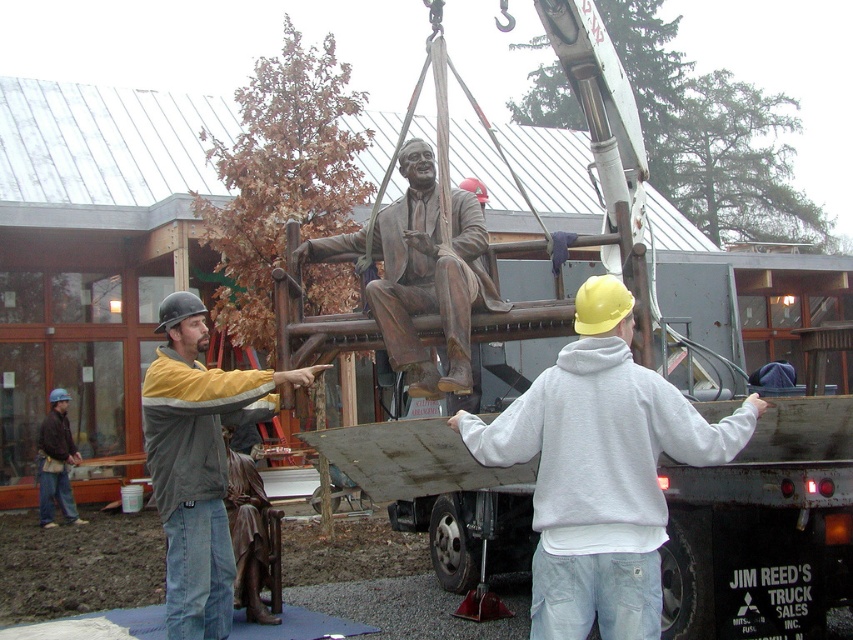
Who is lower down, white matte hoodie at center or brushed metal hard hat at lower left?

brushed metal hard hat at lower left is lower down.

Is point (602, 620) positioned in front of point (39, 467)?

Yes.

At what (x,y) coordinates should I click in order to perform the action: click on white matte hoodie at center. Please return your answer as a coordinate pair (x, y). Looking at the image, I should click on (601, 470).

Does brushed bronze statue at center appear on the left side of bronze statue at center?

Correct, you'll find brushed bronze statue at center to the left of bronze statue at center.

Can you confirm if brushed bronze statue at center is taller than bronze statue at center?

Indeed, brushed bronze statue at center has a greater height compared to bronze statue at center.

Is point (207, 600) less distant than point (415, 225)?

Yes, point (207, 600) is closer to viewer.

Where is `brushed bronze statue at center`? This screenshot has height=640, width=853. brushed bronze statue at center is located at coordinates (198, 461).

Who is shorter, white matte hoodie at center or bronze statue at center?

white matte hoodie at center

What do you see at coordinates (601, 470) in the screenshot? I see `white matte hoodie at center` at bounding box center [601, 470].

Does point (662, 406) come in front of point (463, 196)?

Yes.

Where is `white matte hoodie at center`? white matte hoodie at center is located at coordinates (601, 470).